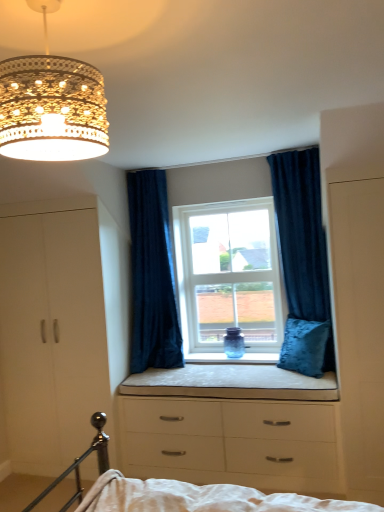
Question: Can you confirm if white matte wardrobe at right is smaller than velvet dark blue curtain at center, acting as the first curtain starting from the left?

Choices:
 (A) yes
 (B) no

Answer: (A)

Question: Is white matte wardrobe at right positioned with its back to velvet dark blue curtain at center, placed as the 2th curtain when sorted from right to left?

Choices:
 (A) yes
 (B) no

Answer: (B)

Question: Is white matte wardrobe at right outside velvet dark blue curtain at center, placed as the 2th curtain when sorted from right to left?

Choices:
 (A) no
 (B) yes

Answer: (B)

Question: Is the depth of white matte wardrobe at right less than that of velvet dark blue curtain at center, placed as the 2th curtain when sorted from right to left?

Choices:
 (A) no
 (B) yes

Answer: (B)

Question: Can you see white matte wardrobe at right touching velvet dark blue curtain at center, placed as the 2th curtain when sorted from right to left?

Choices:
 (A) no
 (B) yes

Answer: (A)

Question: From a real-world perspective, is white matte wardrobe at right located higher than velvet dark blue curtain at center, placed as the 2th curtain when sorted from right to left?

Choices:
 (A) yes
 (B) no

Answer: (B)

Question: Considering the relative positions of velvet blue curtain at upper right, which appears as the 1th curtain when viewed from the right, and white matte dresser at left in the image provided, is velvet blue curtain at upper right, which appears as the 1th curtain when viewed from the right, to the right of white matte dresser at left from the viewer's perspective?

Choices:
 (A) yes
 (B) no

Answer: (A)

Question: From the image's perspective, is velvet blue curtain at upper right, which is counted as the 2th curtain, starting from the left, beneath white matte dresser at left?

Choices:
 (A) no
 (B) yes

Answer: (A)

Question: From the image's perspective, is velvet blue curtain at upper right, which appears as the 1th curtain when viewed from the right, above white matte dresser at left?

Choices:
 (A) no
 (B) yes

Answer: (B)

Question: From a real-world perspective, is velvet blue curtain at upper right, which is counted as the 2th curtain, starting from the left, beneath white matte dresser at left?

Choices:
 (A) yes
 (B) no

Answer: (B)

Question: Can you confirm if velvet blue curtain at upper right, which is counted as the 2th curtain, starting from the left, is wider than white matte dresser at left?

Choices:
 (A) yes
 (B) no

Answer: (A)

Question: Does velvet blue curtain at upper right, which is counted as the 2th curtain, starting from the left, have a lesser height compared to white matte dresser at left?

Choices:
 (A) yes
 (B) no

Answer: (A)

Question: From a real-world perspective, is white glass window at center positioned over velvet blue pillow at center based on gravity?

Choices:
 (A) yes
 (B) no

Answer: (A)